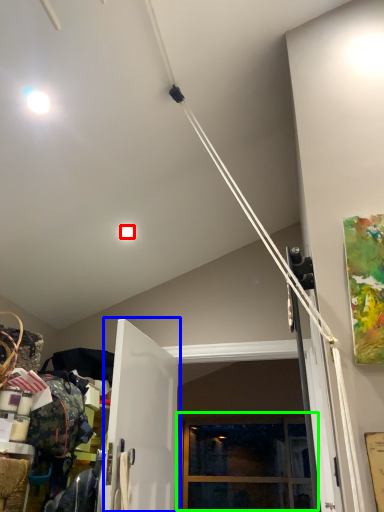
Question: Based on their relative distances, which object is farther from droplight (highlighted by a red box)? Choose from door (highlighted by a blue box) and window (highlighted by a green box).

Choices:
 (A) door
 (B) window

Answer: (B)